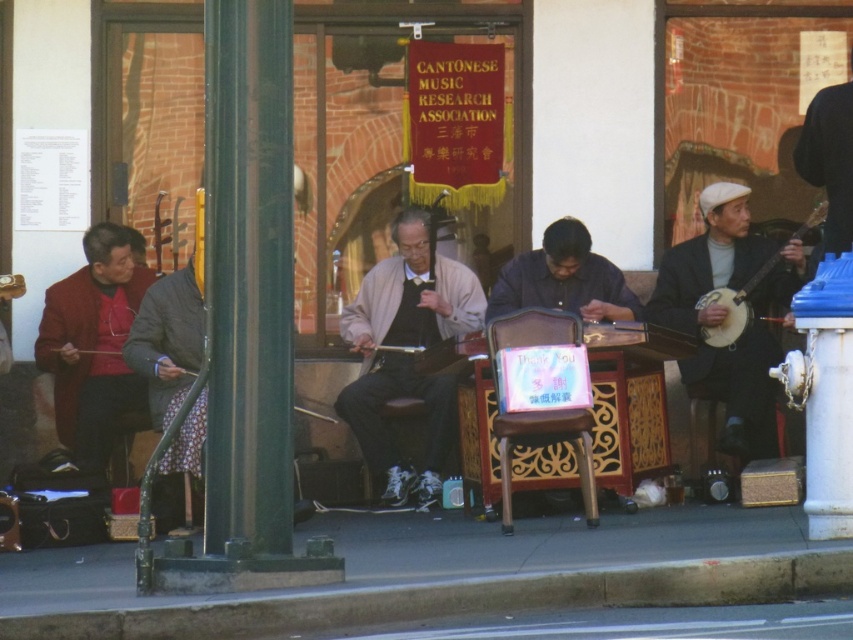
Question: Which of these objects is positioned farthest from the matte gray sweater at center?

Choices:
 (A) green polished metal pole at left
 (B) white wooden banjo at right

Answer: (A)

Question: Which is farther from the concrete at lower center?

Choices:
 (A) white wooden banjo at right
 (B) matte black banjo at right

Answer: (A)

Question: Does concrete at lower center appear under green polished metal pole at left?

Choices:
 (A) no
 (B) yes

Answer: (B)

Question: Among these objects, which one is farthest from the camera?

Choices:
 (A) matte black banjo at right
 (B) matte gray sweater at center
 (C) green polished metal pole at left

Answer: (B)

Question: Can you confirm if green polished metal pole at left is wider than matte black banjo at right?

Choices:
 (A) yes
 (B) no

Answer: (B)

Question: Can you confirm if matte gray sweater at center is positioned to the left of matte red jacket at left?

Choices:
 (A) no
 (B) yes

Answer: (A)